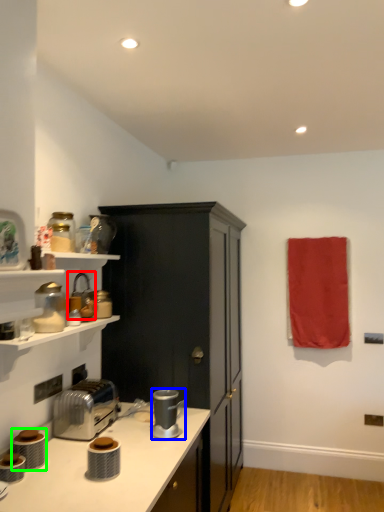
Question: Considering the real-world distances, which object is closest to appliance (highlighted by a red box)? coffee machine (highlighted by a blue box) or appliance (highlighted by a green box).

Choices:
 (A) coffee machine
 (B) appliance

Answer: (A)